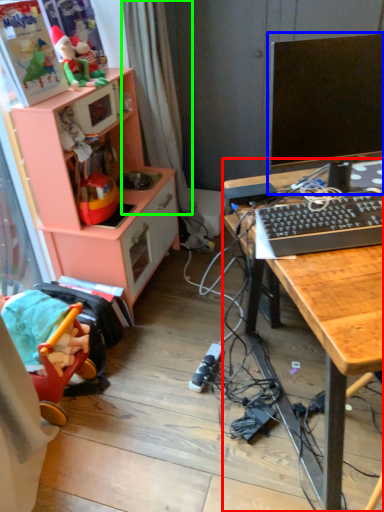
Question: Which object is positioned closest to desk (highlighted by a red box)? Select from computer monitor (highlighted by a blue box) and curtain (highlighted by a green box).

Choices:
 (A) computer monitor
 (B) curtain

Answer: (A)